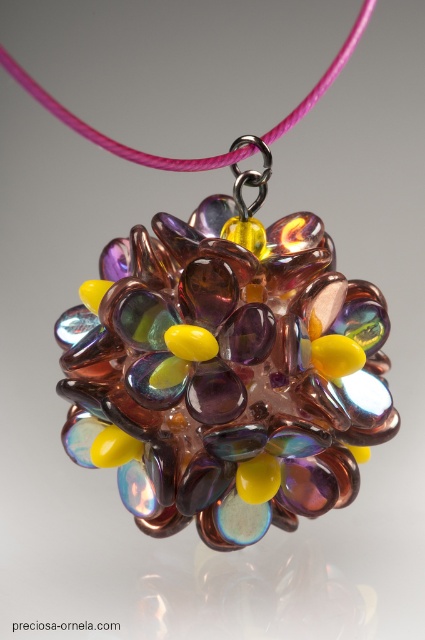
Question: Among these objects, which one is farthest from the camera?

Choices:
 (A) translucent yellow glass bead at center
 (B) pink cord at upper center

Answer: (A)

Question: Does pink cord at upper center appear on the left side of translucent yellow glass bead at center?

Choices:
 (A) no
 (B) yes

Answer: (B)

Question: Which point is farther to the camera?

Choices:
 (A) translucent yellow glass bead at center
 (B) pink cord at upper center

Answer: (A)

Question: Is pink cord at upper center positioned behind translucent yellow glass bead at center?

Choices:
 (A) no
 (B) yes

Answer: (A)

Question: Is pink cord at upper center closer to camera compared to translucent yellow glass bead at center?

Choices:
 (A) yes
 (B) no

Answer: (A)